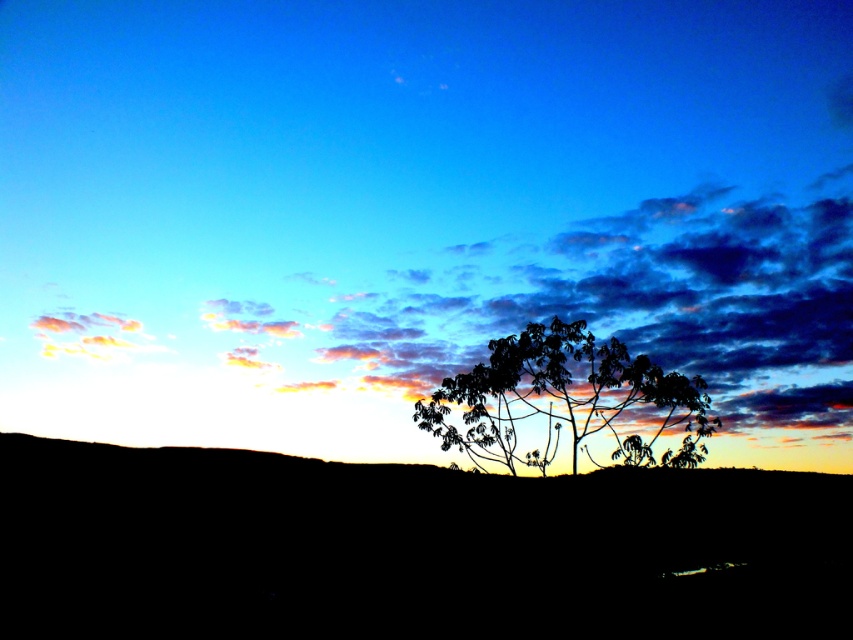
You are an artist sketching the sunset scene. You need to place the cloudy sky at upper center and the silhouette leafy tree at center in your drawing. According to the scene, which object should be positioned to the left side?

The cloudy sky at upper center should be positioned to the left of the silhouette leafy tree at center.

You are an artist trying to paint the sunset scene. You need to decide which part of the image, the cloudy sky at upper center or the silhouette leafy tree at center, requires more vertical space on your canvas. Based on the scene, which one should you allocate more height to?

The cloudy sky at upper center has a greater height compared to the silhouette leafy tree at center, so you should allocate more vertical space to the cloudy sky at upper center on your canvas.

You are an artist trying to paint the sunset scene. You need to decide the placement of the cloudy sky at upper center and the silhouette leafy tree at center. According to the scene, which object should be placed higher in your painting?

The cloudy sky at upper center should be placed higher in the painting because it is located above the silhouette leafy tree at center according to the description.